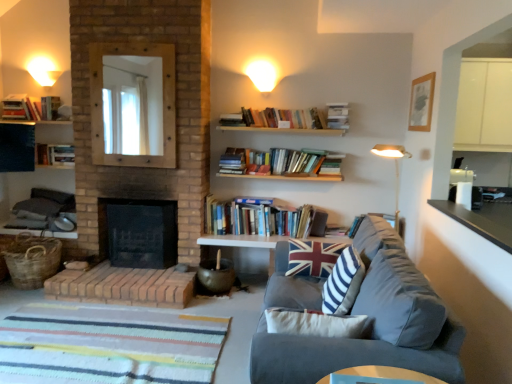
Measure the distance between striped wool rug at lower left and camera.

striped wool rug at lower left and camera are 8.13 feet apart.

Image resolution: width=512 pixels, height=384 pixels. What do you see at coordinates (262, 75) in the screenshot?
I see `white matte lampshade at upper center, placed as the 2th lighting when sorted from back to front` at bounding box center [262, 75].

This screenshot has width=512, height=384. What do you see at coordinates (312, 257) in the screenshot?
I see `union jack fabric pillow at center, acting as the 1th pillow starting from the back` at bounding box center [312, 257].

Measure the distance between hardcover book at upper left, which appears as the 2th book when viewed from the top, and camera.

The depth of hardcover book at upper left, which appears as the 2th book when viewed from the top, is 13.78 feet.

This screenshot has width=512, height=384. What do you see at coordinates (264, 219) in the screenshot?
I see `hardcover books at center, arranged as the 1th book when ordered from the bottom` at bounding box center [264, 219].

Locate an element on the screen. black brick fireplace at center is located at coordinates (139, 232).

From the picture: Is hardcover book at upper left, marked as the 1th book in a left-to-right arrangement, surrounded by black brick fireplace at center?

No, hardcover book at upper left, marked as the 1th book in a left-to-right arrangement, is not inside black brick fireplace at center.

Which point is more forward, (102, 246) or (11, 116)?

The point (11, 116) is closer to the camera.

From the image's perspective, which object appears higher, black brick fireplace at center or hardcover book at upper left, marked as the 1th book in a left-to-right arrangement?

hardcover book at upper left, marked as the 1th book in a left-to-right arrangement, from the image's perspective.

Is black brick fireplace at center not close to hardcover book at upper left, which is the 4th book from bottom to top?

Yes, black brick fireplace at center and hardcover book at upper left, which is the 4th book from bottom to top, are located far from each other.

Does black brick fireplace at center have a greater height compared to striped wool rug at lower left?

Indeed, black brick fireplace at center has a greater height compared to striped wool rug at lower left.

Is black brick fireplace at center to the left or to the right of striped wool rug at lower left in the image?

From the image, it's evident that black brick fireplace at center is to the left of striped wool rug at lower left.

Choose the correct answer: Is black brick fireplace at center inside striped wool rug at lower left or outside it?

black brick fireplace at center cannot be found inside striped wool rug at lower left.

From the image's perspective, does black brick fireplace at center appear lower than striped wool rug at lower left?

No.

Could you measure the distance between velvet gray couch at lower right and union jack fabric pillow at center, acting as the 1th pillow starting from the back?

They are 66.07 centimeters apart.

Between point (304, 342) and point (313, 253), which one is positioned behind?

The point (313, 253) is more distant.

From the image's perspective, is velvet gray couch at lower right beneath union jack fabric pillow at center, the 2th pillow positioned from the front?

Indeed, from the image's perspective, velvet gray couch at lower right is shown beneath union jack fabric pillow at center, the 2th pillow positioned from the front.

This screenshot has width=512, height=384. In the image, there is a union jack fabric pillow at center, acting as the 1th pillow starting from the back. Find the location of `studio couch below it (from a real-world perspective)`. studio couch below it (from a real-world perspective) is located at coordinates (371, 324).

How many degrees apart are the facing directions of woven brown basket at lower left and hardcover book at upper left, which is the 4th book from bottom to top?

The facing directions of woven brown basket at lower left and hardcover book at upper left, which is the 4th book from bottom to top, are 7.67 degrees apart.

Is point (42, 266) closer to camera compared to point (20, 112)?

Yes, it is.

Can you confirm if woven brown basket at lower left is taller than hardcover book at upper left, marked as the 1th book in a left-to-right arrangement?

Correct, woven brown basket at lower left is much taller as hardcover book at upper left, marked as the 1th book in a left-to-right arrangement.

Looking at this image, is wooden mirror at upper left not close to hardcover book at upper left, marked as the 1th book in a left-to-right arrangement?

wooden mirror at upper left is near hardcover book at upper left, marked as the 1th book in a left-to-right arrangement, not far away.

From the image's perspective, which one is positioned higher, wooden mirror at upper left or hardcover book at upper left, the 5th book viewed from the right?

From the image's view, hardcover book at upper left, the 5th book viewed from the right, is above.

Considering the sizes of objects wooden mirror at upper left and hardcover book at upper left, which is the 4th book from bottom to top, in the image provided, who is smaller, wooden mirror at upper left or hardcover book at upper left, which is the 4th book from bottom to top,?

hardcover book at upper left, which is the 4th book from bottom to top.

From a real-world perspective, which object rests below the other?

In real-world perspective, hardcover book at upper left, marked as the 1th book in a left-to-right arrangement, is lower.

Can you confirm if striped wool rug at lower left is wider than union jack fabric pillow at center, acting as the 1th pillow starting from the back?

Yes.

Looking at this image, considering the relative positions of striped wool rug at lower left and union jack fabric pillow at center, the 2th pillow positioned from the front, in the image provided, is striped wool rug at lower left to the left of union jack fabric pillow at center, the 2th pillow positioned from the front, from the viewer's perspective?

Indeed, striped wool rug at lower left is positioned on the left side of union jack fabric pillow at center, the 2th pillow positioned from the front.

From a real-world perspective, is striped wool rug at lower left physically located above or below union jack fabric pillow at center, the 2th pillow positioned from the front?

From a real-world perspective, striped wool rug at lower left is physically below union jack fabric pillow at center, the 2th pillow positioned from the front.

From the image's perspective, is striped wool rug at lower left below union jack fabric pillow at center, the 2th pillow positioned from the front?

Yes.

Are striped wool rug at lower left and black brick fireplace at center beside each other?

There is a gap between striped wool rug at lower left and black brick fireplace at center.

Is striped wool rug at lower left smaller than black brick fireplace at center?

Yes, striped wool rug at lower left is smaller than black brick fireplace at center.

Does striped wool rug at lower left come in front of black brick fireplace at center?

Yes, striped wool rug at lower left is closer to the camera.

Between striped wool rug at lower left and black brick fireplace at center, which one appears on the left side from the viewer's perspective?

Positioned to the left is black brick fireplace at center.

In order to click on fireplace on the right of hardcover book at upper left, which is the 4th book from bottom to top in this screenshot , I will do `click(139, 232)`.

At what (x,y) coordinates should I click in order to perform the action: click on flat below the black brick fireplace at center (from the image's perspective). Please return your answer as a coordinate pair (x, y). Image resolution: width=512 pixels, height=384 pixels. Looking at the image, I should click on (111, 344).

Based on their spatial positions, is smooth wooden table at lower center or hardcover books at center, which ranks as the fifth book in top-to-bottom order, closer to hardcover book at upper left, which appears as the 2th book when viewed from the top?

Based on the image, hardcover books at center, which ranks as the fifth book in top-to-bottom order, appears to be nearer to hardcover book at upper left, which appears as the 2th book when viewed from the top.

Which object lies further to the anchor point striped wool rug at lower left, union jack fabric pillow at center, the 2th pillow positioned from the front, or smooth wooden table at lower center?

The object further to striped wool rug at lower left is smooth wooden table at lower center.

Considering their positions, is wooden picture frame at upper right positioned further to black brick fireplace at center than hardcover books at left, positioned as the 4th book in top-to-bottom order?

wooden picture frame at upper right lies further to black brick fireplace at center than the other object.

Looking at the image, which one is located closer to velvet gray couch at lower right, wooden mirror at upper left or matte black shelf at left?

wooden mirror at upper left lies closer to velvet gray couch at lower right than the other object.

Considering their positions, is woven brown basket at lower left positioned further to white matte wall sconce at upper left, which ranks as the second lighting in right-to-left order, than hardcover books at left, which is the second book from bottom to top?

woven brown basket at lower left is positioned further to the anchor white matte wall sconce at upper left, which ranks as the second lighting in right-to-left order.

Looking at the image, which one is located further to white matte wall sconce at upper left, marked as the first lighting in a back-to-front arrangement, black laminate countertop at right or wooden picture frame at upper right?

The object further to white matte wall sconce at upper left, marked as the first lighting in a back-to-front arrangement, is black laminate countertop at right.

Considering their positions, is velvet gray couch at lower right positioned further to hardcover book at upper center, the third book from the bottom, than black laminate countertop at right?

velvet gray couch at lower right is positioned further to the anchor hardcover book at upper center, the third book from the bottom.

Considering their positions, is smooth wooden table at lower center positioned closer to hardcover book at upper center, which is the 3th book in top-to-bottom order, than wooden picture frame at upper right?

The object closer to hardcover book at upper center, which is the 3th book in top-to-bottom order, is wooden picture frame at upper right.

Locate an element on the screen. mirror situated between hardcover book at upper left, the first book positioned from the top, and striped fabric pillow at center, acting as the 1th pillow starting from the front, from left to right is located at coordinates (133, 104).

The width and height of the screenshot is (512, 384). I want to click on studio couch between white matte wall sconce at upper left, the 1th lighting positioned from the left, and black laminate countertop at right, so click(x=371, y=324).

Locate an element on the screen. pillow between striped wool rug at lower left and striped fabric pillow at center, placed as the second pillow when sorted from back to front, in the horizontal direction is located at coordinates (312, 257).

At what (x,y) coordinates should I click in order to perform the action: click on fireplace between striped wool rug at lower left and hardcover book at upper left, the first book positioned from the top, from front to back. Please return your answer as a coordinate pair (x, y). Looking at the image, I should click on (139, 232).